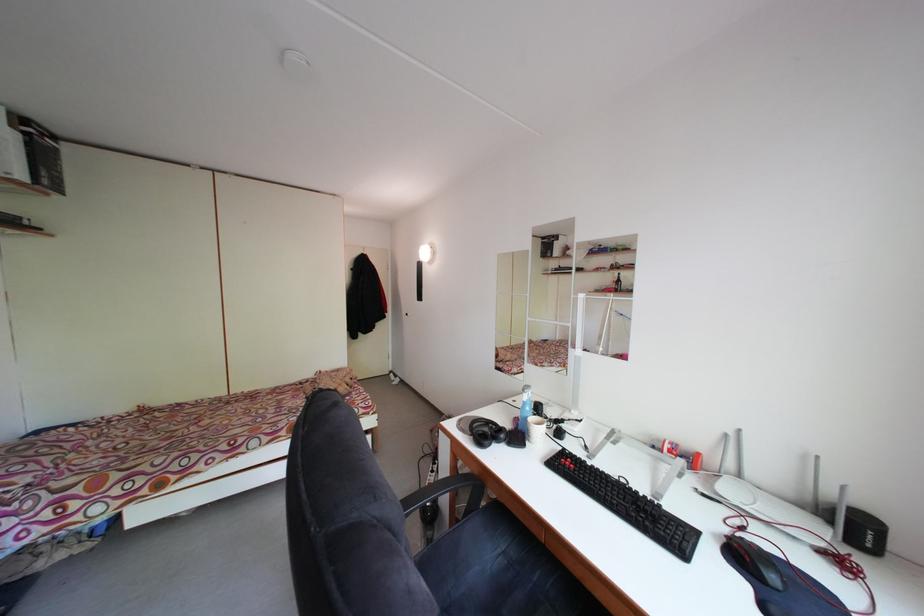
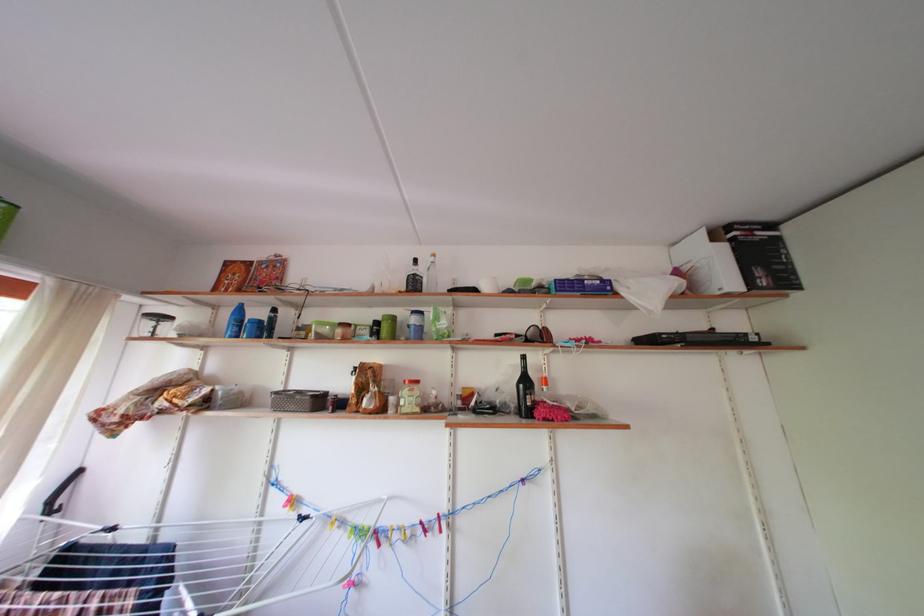
Question: I am providing you with two images of the same scene from different viewpoints. After the viewpoint changes to image2, which objects are now occluded?

Choices:
 (A) black spray can
 (B) blue plastic bottle
 (C) small blue crate
 (D) none of these

Answer: (D)